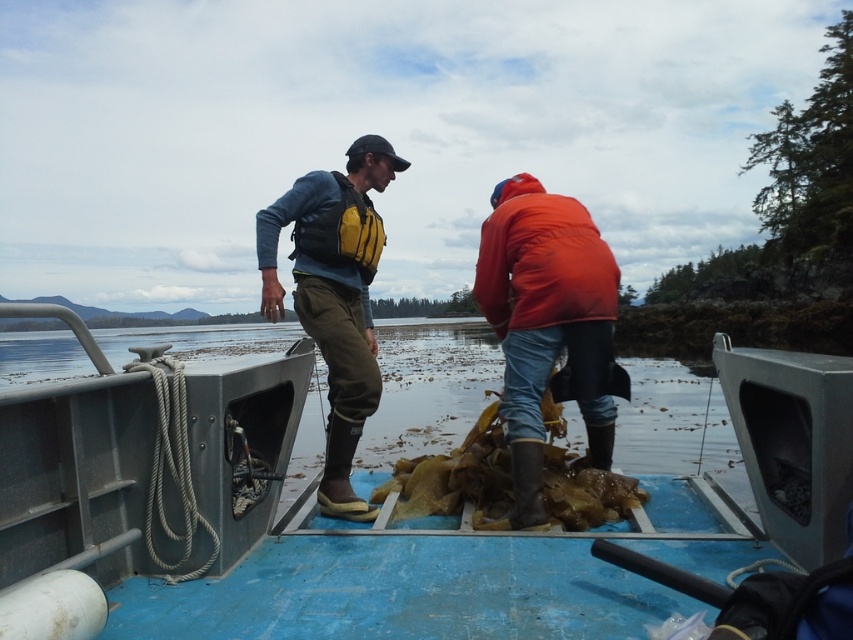
Question: Does clear water at center have a larger size compared to orange matte jacket at center?

Choices:
 (A) no
 (B) yes

Answer: (B)

Question: Which point is farther to the camera?

Choices:
 (A) (650, 422)
 (B) (531, 269)
 (C) (317, 225)

Answer: (A)

Question: In this image, where is metallic blue boat at center located relative to matte yellow life vest at center?

Choices:
 (A) above
 (B) below

Answer: (B)

Question: Which object appears farthest from the camera in this image?

Choices:
 (A) clear water at center
 (B) orange matte jacket at center
 (C) matte yellow life vest at center

Answer: (C)

Question: Is clear water at center thinner than matte yellow life vest at center?

Choices:
 (A) no
 (B) yes

Answer: (A)

Question: Which object is positioned closest to the orange matte jacket at center?

Choices:
 (A) metallic blue boat at center
 (B) clear water at center

Answer: (A)